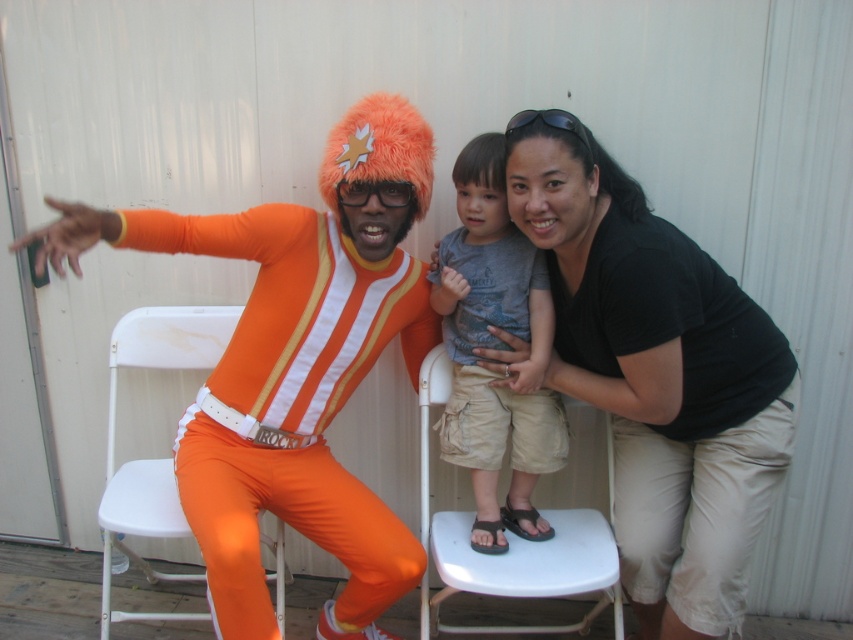
Question: Which is farther from the gray cotton shirt at center?

Choices:
 (A) black plastic goggles at upper center
 (B) white plastic chair at lower center
 (C) orange spandex suit at left
 (D) white plastic chair at left

Answer: (D)

Question: Based on their relative distances, which object is farther from the gray cotton shirt at center?

Choices:
 (A) white plastic chair at lower center
 (B) white plastic chair at left

Answer: (B)

Question: In this image, where is orange spandex suit at left located relative to black plastic goggles at upper center?

Choices:
 (A) below
 (B) above

Answer: (A)

Question: Can you confirm if black cotton shirt at upper right is wider than black plastic goggles at upper center?

Choices:
 (A) yes
 (B) no

Answer: (A)

Question: Can you confirm if black cotton shirt at upper right is positioned above white plastic chair at lower center?

Choices:
 (A) yes
 (B) no

Answer: (A)

Question: Which point is farther from the camera taking this photo?

Choices:
 (A) (425, 582)
 (B) (227, 451)
 (C) (561, 129)

Answer: (A)